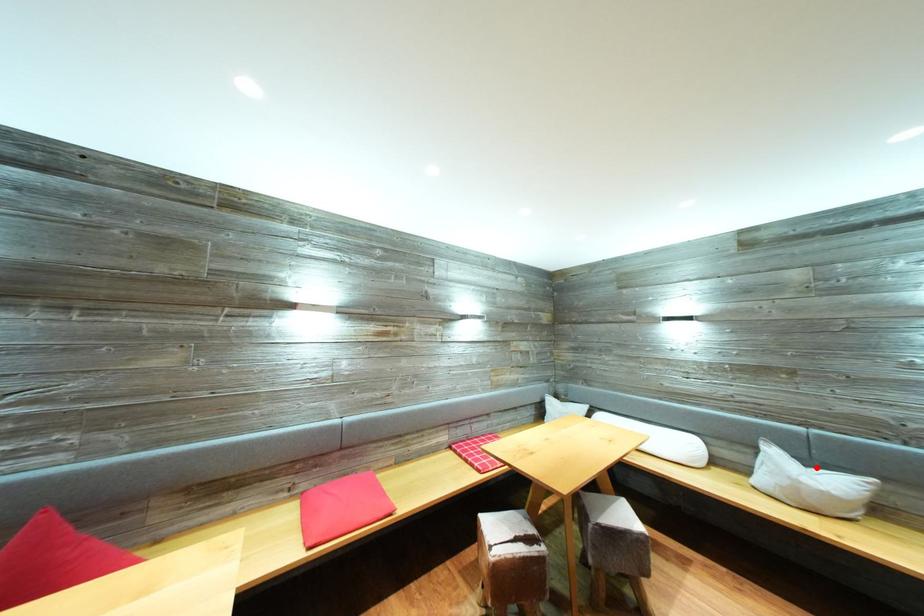
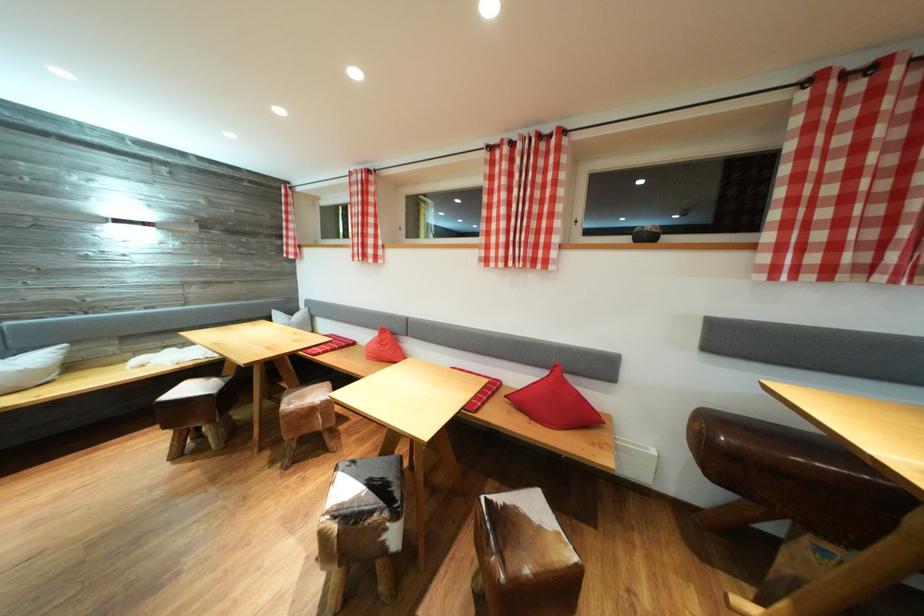
In the second image, find the point that corresponds to the highlighted location in the first image.

(14, 358)